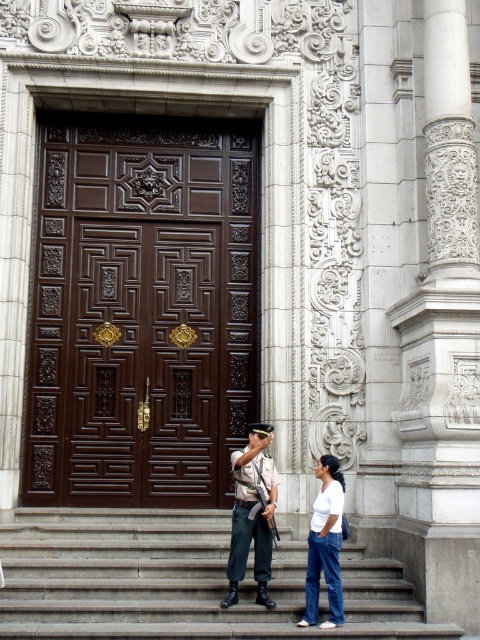
Does dark wood door at center appear over white cotton shirt at lower center?

Yes.

Is dark wood door at center behind white cotton shirt at lower center?

Yes, dark wood door at center is behind white cotton shirt at lower center.

Is point (244, 417) positioned behind point (336, 556)?

Yes.

I want to click on dark wood door at center, so click(x=142, y=308).

Looking at this image, is the position of white stone column at right less distant than that of light brown uniform at center?

Yes, it is in front of light brown uniform at center.

This screenshot has height=640, width=480. Identify the location of white stone column at right. (443, 344).

I want to click on white stone column at right, so click(x=443, y=344).

Does gray concrete stairs at lower center have a greater height compared to light brown uniform at center?

In fact, gray concrete stairs at lower center may be shorter than light brown uniform at center.

Does gray concrete stairs at lower center appear on the left side of light brown uniform at center?

Correct, you'll find gray concrete stairs at lower center to the left of light brown uniform at center.

The width and height of the screenshot is (480, 640). I want to click on gray concrete stairs at lower center, so click(x=179, y=580).